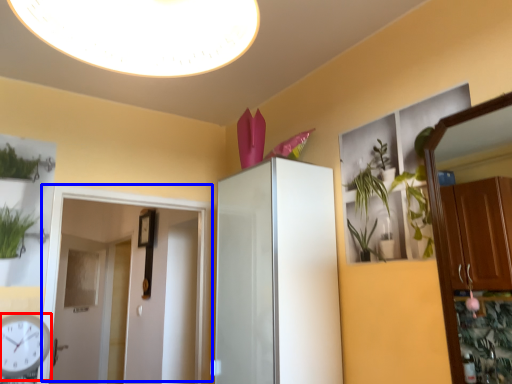
Question: Which object appears farthest to the camera in this image, clock (highlighted by a red box) or door (highlighted by a blue box)?

Choices:
 (A) clock
 (B) door

Answer: (B)